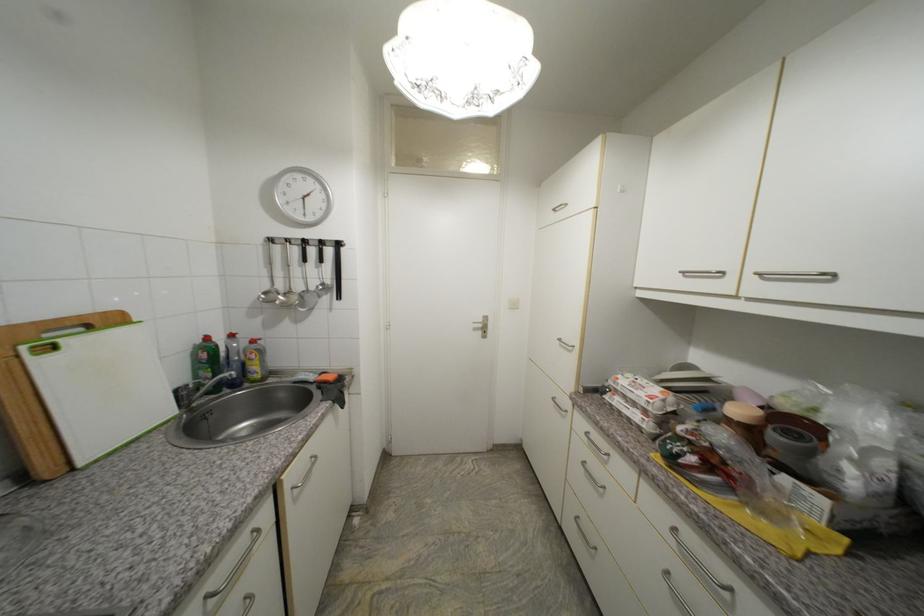
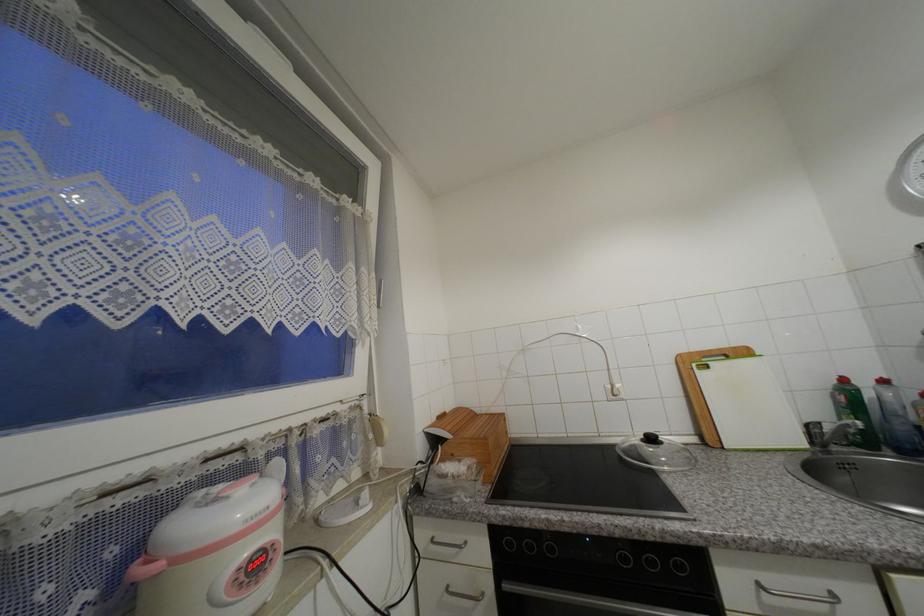
Find the pixel in the second image that matches (181,392) in the first image.

(812, 428)